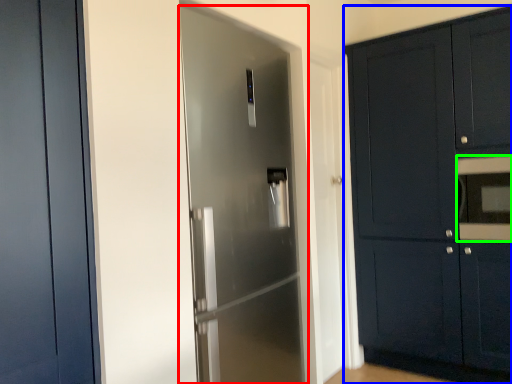
Question: Which object is positioned farthest from door (highlighted by a red box)? Select from cabinetry (highlighted by a blue box) and oven (highlighted by a green box).

Choices:
 (A) cabinetry
 (B) oven

Answer: (B)